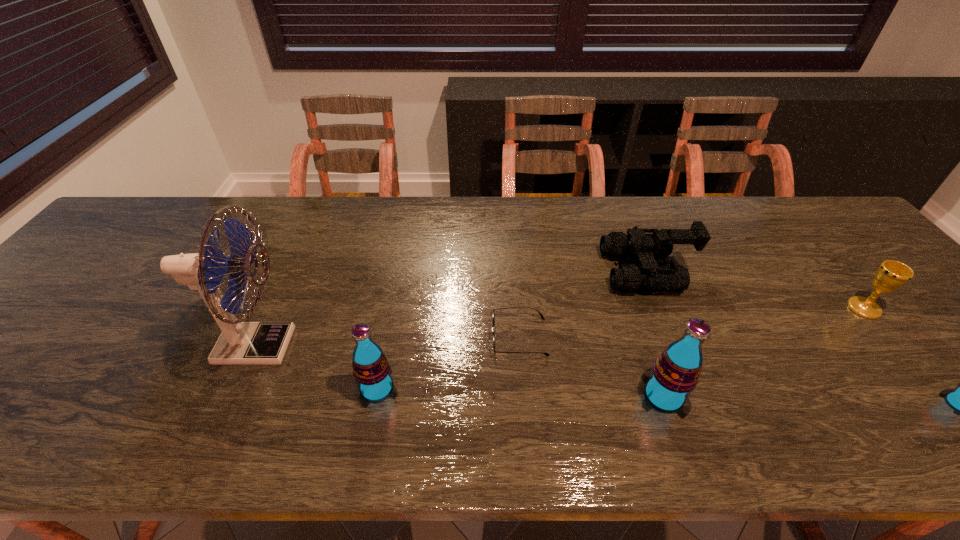
Find the location of a particular element. This screenshot has width=960, height=540. object that is at the right edge is located at coordinates (891, 275).

The image size is (960, 540). In the image, there is a desktop. What are the coordinates of `free region at the far edge` in the screenshot? It's located at (736, 232).

In the image, there is a desktop. Where is `vacant region at the left edge`? Image resolution: width=960 pixels, height=540 pixels. vacant region at the left edge is located at coordinates (41, 313).

What are the coordinates of `vacant space at the right edge` in the screenshot? It's located at (875, 289).

Locate an element on the screen. Image resolution: width=960 pixels, height=540 pixels. vacant space at the far left corner of the desktop is located at coordinates (116, 241).

Where is `vacant space at the far right corner of the desktop`? Image resolution: width=960 pixels, height=540 pixels. vacant space at the far right corner of the desktop is located at coordinates (843, 229).

At what (x,y) coordinates should I click in order to perform the action: click on unoccupied position between the binoculars and the second soda from left to right. Please return your answer as a coordinate pair (x, y). The width and height of the screenshot is (960, 540). Looking at the image, I should click on click(x=655, y=334).

I want to click on free space between the chalice and the second shortest soda, so click(620, 348).

The width and height of the screenshot is (960, 540). What are the coordinates of `vacant area between the sixth object from right to left and the tallest object` in the screenshot? It's located at (317, 367).

The height and width of the screenshot is (540, 960). What are the coordinates of `blank region between the leftmost soda and the tallest object` in the screenshot? It's located at tap(317, 367).